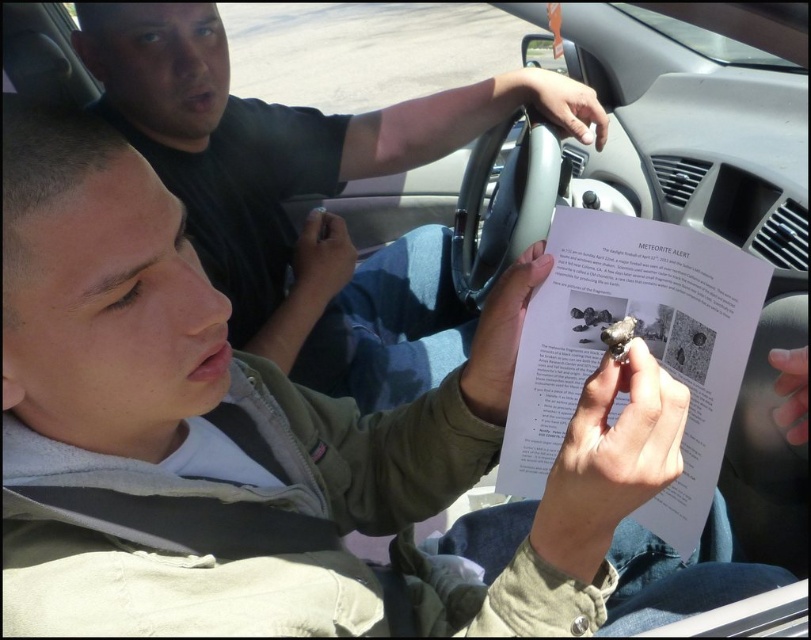
Question: Is the position of matte black paper at center less distant than that of shiny metallic rock at center?

Choices:
 (A) yes
 (B) no

Answer: (B)

Question: Can you confirm if matte black paper at center is smaller than shiny metallic rock at center?

Choices:
 (A) no
 (B) yes

Answer: (A)

Question: Which of the following is the farthest from the observer?

Choices:
 (A) (534, 346)
 (B) (101, 29)

Answer: (B)

Question: Which point appears closest to the camera in this image?

Choices:
 (A) (543, 346)
 (B) (337, 250)

Answer: (A)

Question: Can you confirm if matte black paper at center is wider than shiny metallic rock at center?

Choices:
 (A) no
 (B) yes

Answer: (B)